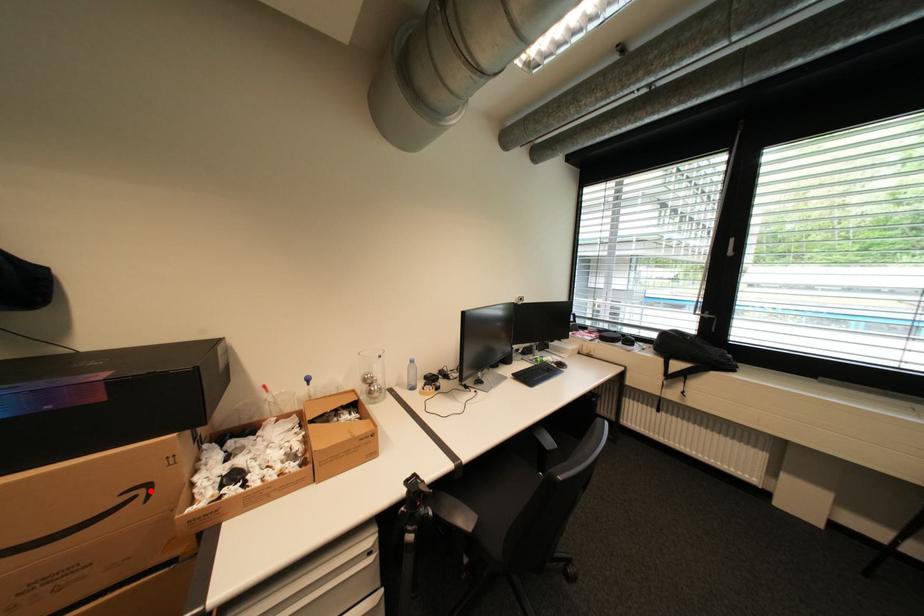
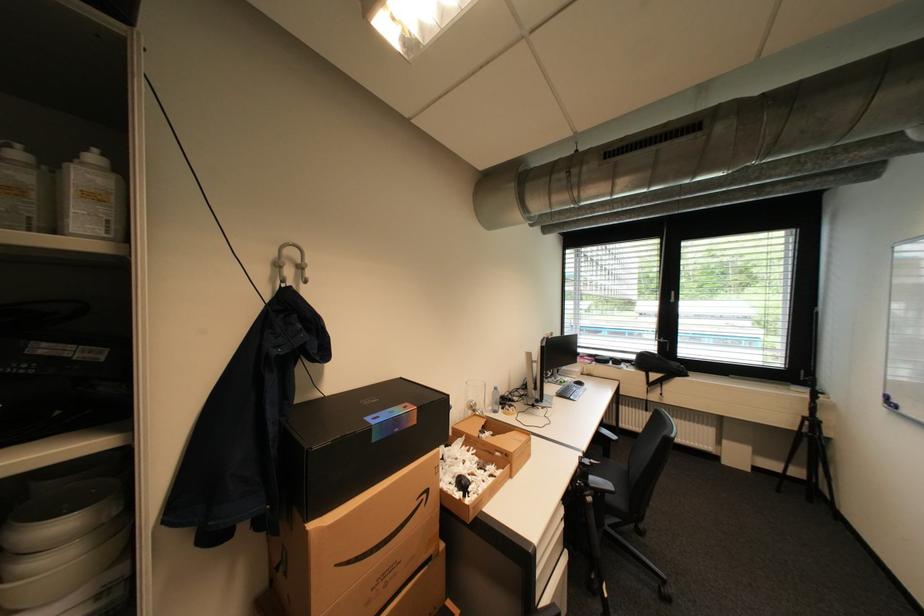
In the second image, find the point that corresponds to the highlighted location in the first image.

(433, 496)